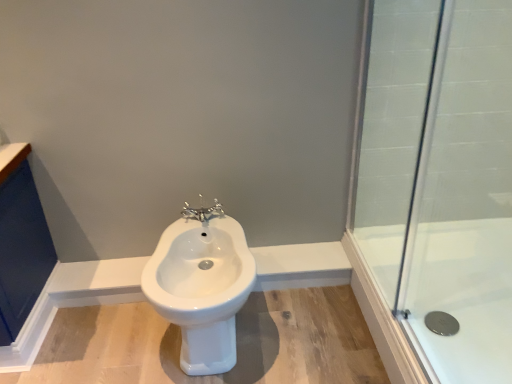
Question: From a real-world perspective, does chrome metallic faucet at center stand above clear glass shower at right?

Choices:
 (A) yes
 (B) no

Answer: (A)

Question: From the image's perspective, does chrome metallic faucet at center appear lower than clear glass shower at right?

Choices:
 (A) no
 (B) yes

Answer: (A)

Question: Considering the relative positions of chrome metallic faucet at center and clear glass shower at right in the image provided, is chrome metallic faucet at center to the left of clear glass shower at right from the viewer's perspective?

Choices:
 (A) no
 (B) yes

Answer: (B)

Question: Does chrome metallic faucet at center have a greater height compared to clear glass shower at right?

Choices:
 (A) yes
 (B) no

Answer: (B)

Question: Can you confirm if chrome metallic faucet at center is thinner than clear glass shower at right?

Choices:
 (A) no
 (B) yes

Answer: (B)

Question: From a real-world perspective, is chrome metallic faucet at center positioned under clear glass shower at right based on gravity?

Choices:
 (A) no
 (B) yes

Answer: (A)

Question: Is transparent glass shower door at right positioned behind clear glass shower at right?

Choices:
 (A) no
 (B) yes

Answer: (A)

Question: Is transparent glass shower door at right bigger than clear glass shower at right?

Choices:
 (A) yes
 (B) no

Answer: (B)

Question: Is transparent glass shower door at right facing towards clear glass shower at right?

Choices:
 (A) yes
 (B) no

Answer: (B)

Question: Is transparent glass shower door at right thinner than clear glass shower at right?

Choices:
 (A) no
 (B) yes

Answer: (B)

Question: From the image's perspective, is transparent glass shower door at right over clear glass shower at right?

Choices:
 (A) no
 (B) yes

Answer: (B)

Question: From a real-world perspective, is transparent glass shower door at right below clear glass shower at right?

Choices:
 (A) yes
 (B) no

Answer: (B)

Question: Is white glossy bidet at center positioned in front of clear glass shower at right?

Choices:
 (A) no
 (B) yes

Answer: (B)